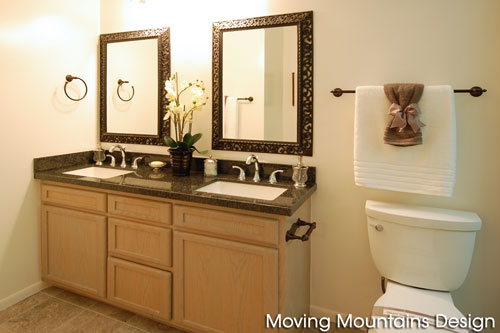
You are a GUI agent. You are given a task and a screenshot of the screen. Output one action in this format:
    pyautogui.click(x=<x>, y=<y>)
    Task: Click on the hot and cold handles
    This screenshot has height=333, width=500.
    Given the screenshot: What is the action you would take?
    pyautogui.click(x=236, y=166), pyautogui.click(x=276, y=170), pyautogui.click(x=136, y=160), pyautogui.click(x=111, y=158)